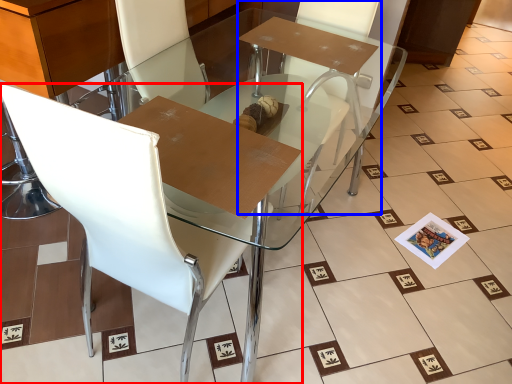
Question: Which point is further to the camera, chair (highlighted by a red box) or armchair (highlighted by a blue box)?

Choices:
 (A) chair
 (B) armchair

Answer: (B)